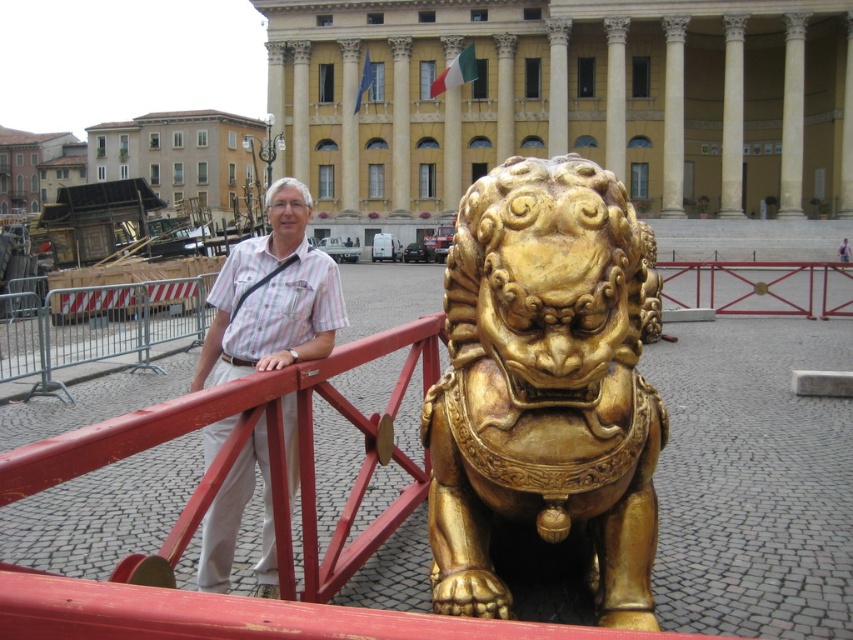
Is gold polished lion at center closer to camera compared to metallic silver fence at left?

Yes, it is.

Does gold polished lion at center have a greater width compared to metallic silver fence at left?

In fact, gold polished lion at center might be narrower than metallic silver fence at left.

Identify the location of gold polished lion at center. (546, 387).

Is point (442, 452) farther from camera compared to point (239, 496)?

No, (442, 452) is in front of (239, 496).

At what (x,y) coordinates should I click in order to perform the action: click on gold polished lion at center. Please return your answer as a coordinate pair (x, y). Looking at the image, I should click on (546, 387).

You are a GUI agent. You are given a task and a screenshot of the screen. Output one action in this format:
    pyautogui.click(x=<x>, y=<y>)
    Task: Click on the gold polished lion at center
    The width and height of the screenshot is (853, 640).
    Given the screenshot: What is the action you would take?
    pyautogui.click(x=546, y=387)

Locate an element on the screen. The height and width of the screenshot is (640, 853). white striped shirt at center is located at coordinates (271, 296).

Which of these two, white striped shirt at center or metallic silver fence at left, stands shorter?

With less height is metallic silver fence at left.

Between point (273, 538) and point (38, 314), which one is positioned in front?

Positioned in front is point (273, 538).

What are the coordinates of `white striped shirt at center` in the screenshot? It's located at 271,296.